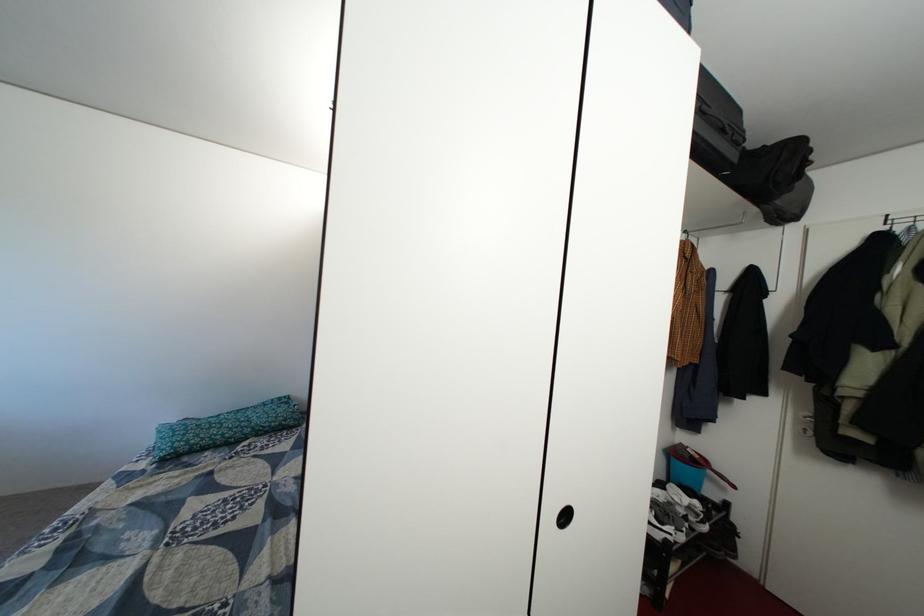
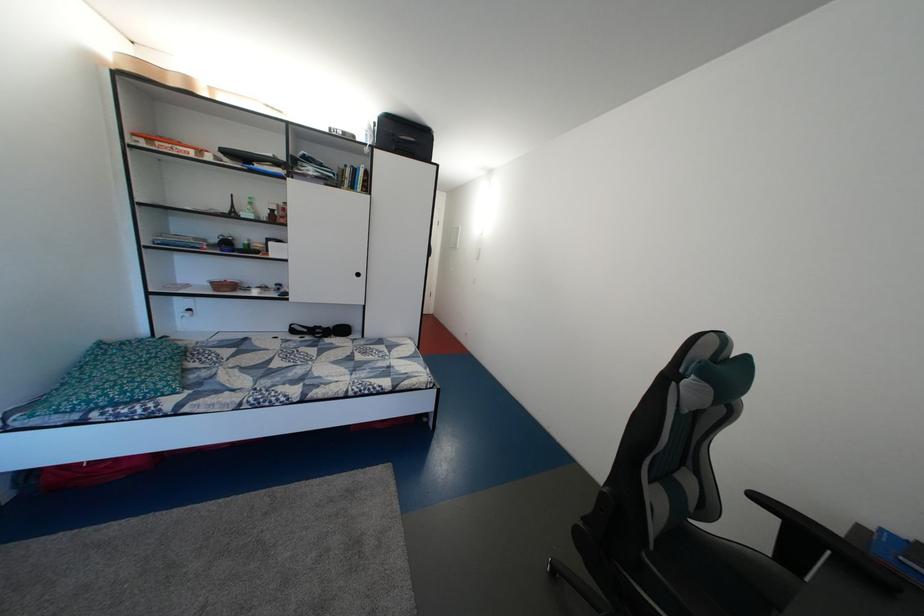
Locate, in the second image, the point that corresponds to (222,435) in the first image.

(160, 376)